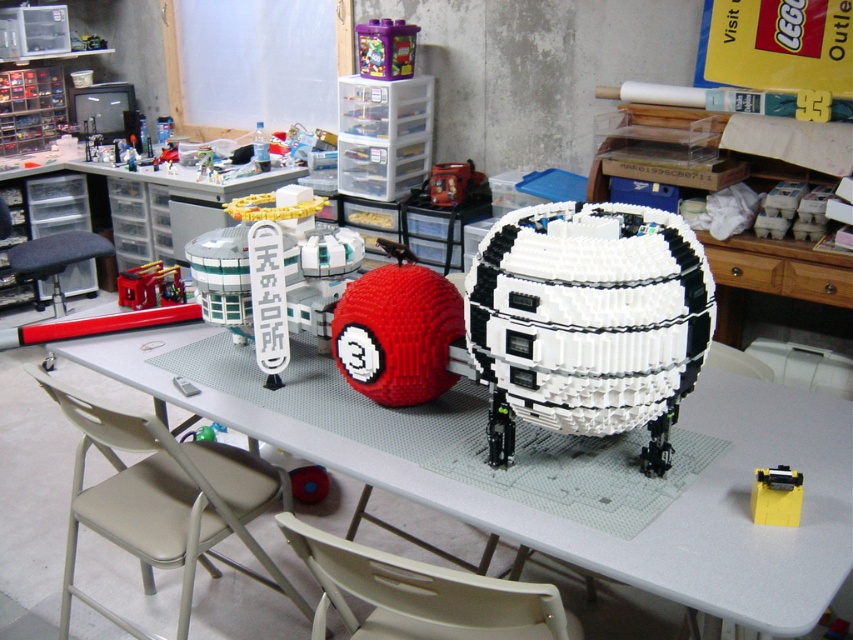
Question: Can you confirm if beige fabric chair at lower left is smaller than metallic red backpack at center?

Choices:
 (A) no
 (B) yes

Answer: (A)

Question: Which point is closer to the camera taking this photo?

Choices:
 (A) (80, 241)
 (B) (432, 177)
 (C) (361, 29)

Answer: (C)

Question: Does black fabric stool at left appear under translucent purple plastic container at upper center?

Choices:
 (A) yes
 (B) no

Answer: (A)

Question: Which point is farther to the camera?

Choices:
 (A) (138, 388)
 (B) (682, 353)
 (C) (419, 614)

Answer: (A)

Question: Estimate the real-world distances between objects in this image. Which object is closer to the black fabric stool at left?

Choices:
 (A) beige fabric chair at lower left
 (B) metallic red backpack at center
 (C) yellow plastic car at lower right
 (D) metallic red car at center

Answer: (D)

Question: Is beige plastic chair at lower center positioned at the back of metallic red backpack at center?

Choices:
 (A) no
 (B) yes

Answer: (A)